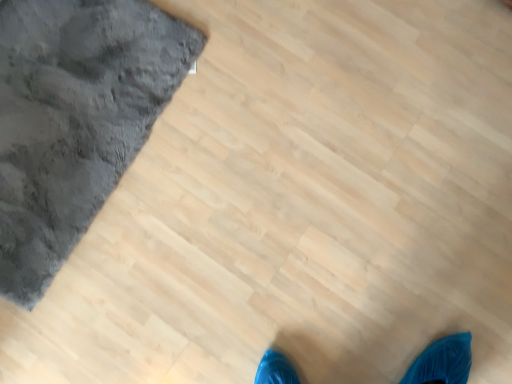
In order to click on free point above dark gray plush bath mat at upper left (from a real-world perspective) in this screenshot , I will do `click(60, 112)`.